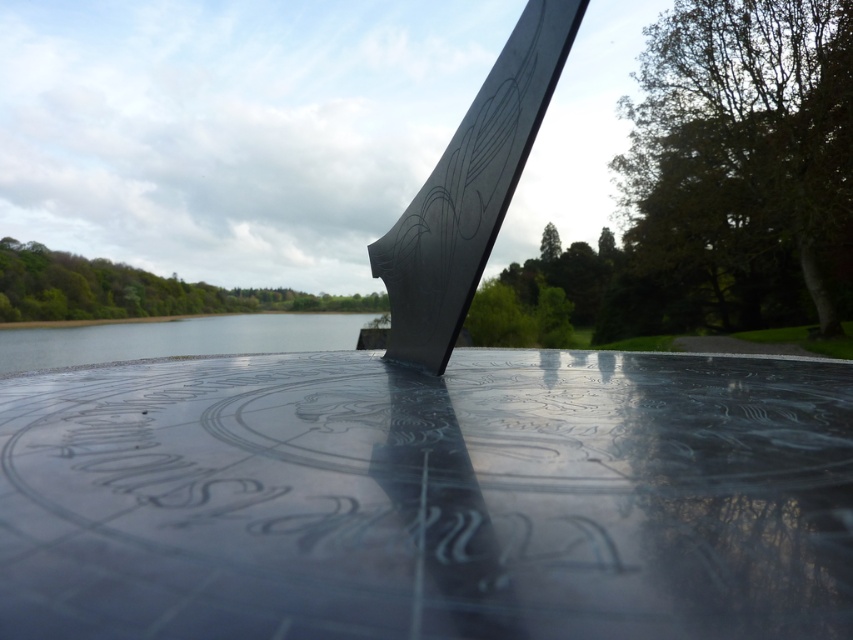
Can you confirm if black polished metal blade at center is shorter than clear water at lower left?

In fact, black polished metal blade at center may be taller than clear water at lower left.

Which of these two, black polished metal blade at center or clear water at lower left, stands taller?

black polished metal blade at center is taller.

The height and width of the screenshot is (640, 853). I want to click on black polished metal blade at center, so click(469, 189).